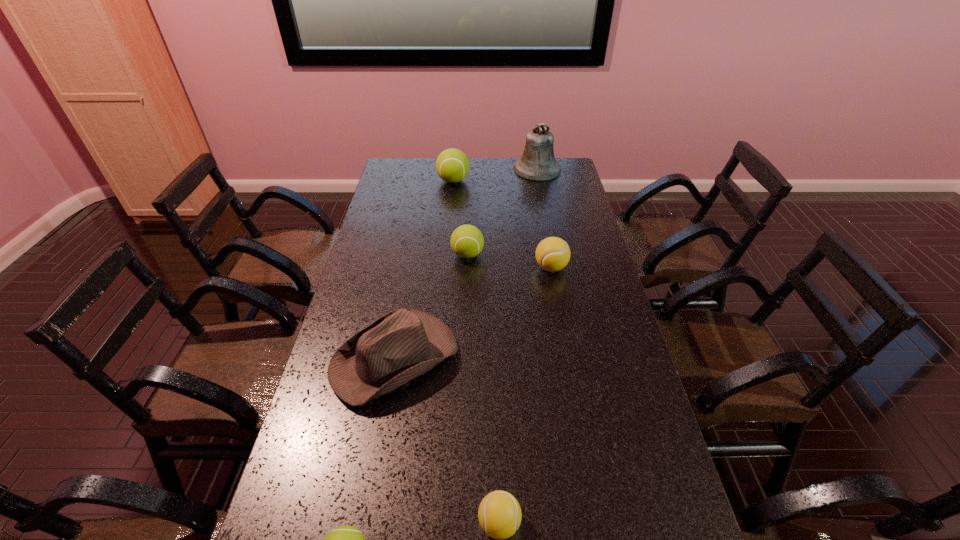
Where is `the fourth closest tennis ball to the bell`? the fourth closest tennis ball to the bell is located at coordinates (499, 514).

Identify which tennis ball is located as the nearest to the farther yellow tennis ball. Please provide its 2D coordinates. Your answer should be formatted as a tuple, i.e. [(x, y)], where the tuple contains the x and y coordinates of a point satisfying the conditions above.

[(467, 241)]

Identify which green tennis ball is located as the second nearest to the fedora. Please provide its 2D coordinates. Your answer should be formatted as a tuple, i.e. [(x, y)], where the tuple contains the x and y coordinates of a point satisfying the conditions above.

[(346, 539)]

I want to click on green tennis ball that stands as the third closest to the left yellow tennis ball, so click(452, 165).